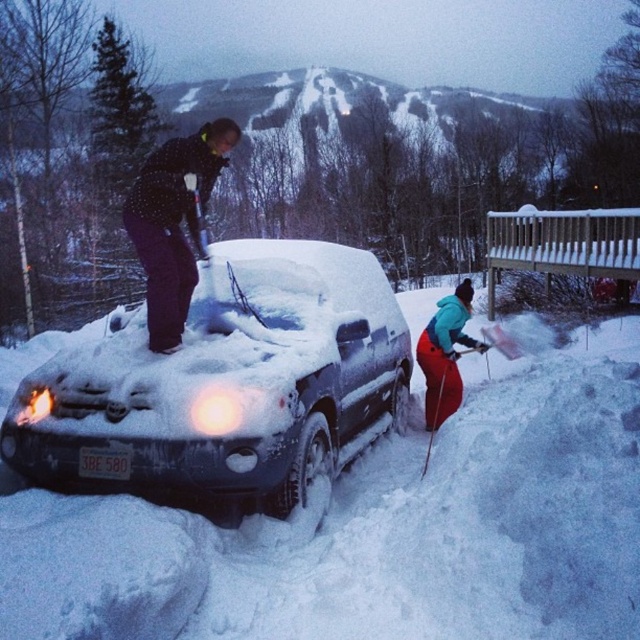
You are a photographer trying to capture a photo of the two people clearing snow from the SUV. Which person wearing the polka dot fabric jacket at upper left or the teal fabric jacket at center should you focus on first if you want to include both in the frame without moving your camera position? Explain your reasoning based on their positions.

The polka dot fabric jacket at upper left should be focused on first because it is positioned to the left of the teal fabric jacket at center, ensuring both can be included in the frame when starting from the left side.